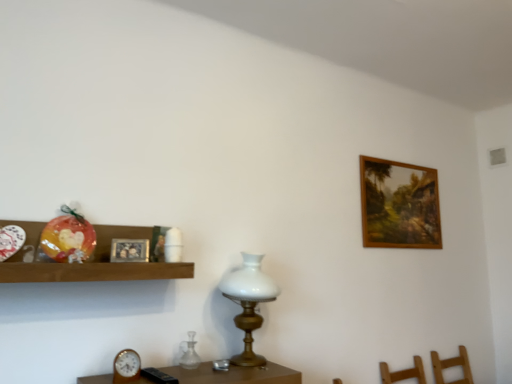
Question: Visually, is wooden framed painting at upper right, which is the first picture frame in back-to-front order, positioned to the left or to the right of white glass table lamp at center?

Choices:
 (A) left
 (B) right

Answer: (B)

Question: Is wooden framed painting at upper right, which is the first picture frame in back-to-front order, inside or outside of white glass table lamp at center?

Choices:
 (A) inside
 (B) outside

Answer: (B)

Question: Which object is positioned closest to the transparent glass vase at center?

Choices:
 (A) white glass table lamp at center
 (B) wooden clock at lower left
 (C) wooden framed painting at upper right, which is the first picture frame in back-to-front order
 (D) silver metallic picture frame at upper left, placed as the 1th picture frame when sorted from front to back
 (E) wooden shelf at left

Answer: (B)

Question: Which of these objects is positioned closest to the silver metallic picture frame at upper left, acting as the first picture frame starting from the left?

Choices:
 (A) wooden clock at lower left
 (B) transparent glass vase at center
 (C) wooden framed painting at upper right, the second picture frame in the left-to-right sequence
 (D) white glass table lamp at center
 (E) wooden shelf at left

Answer: (E)